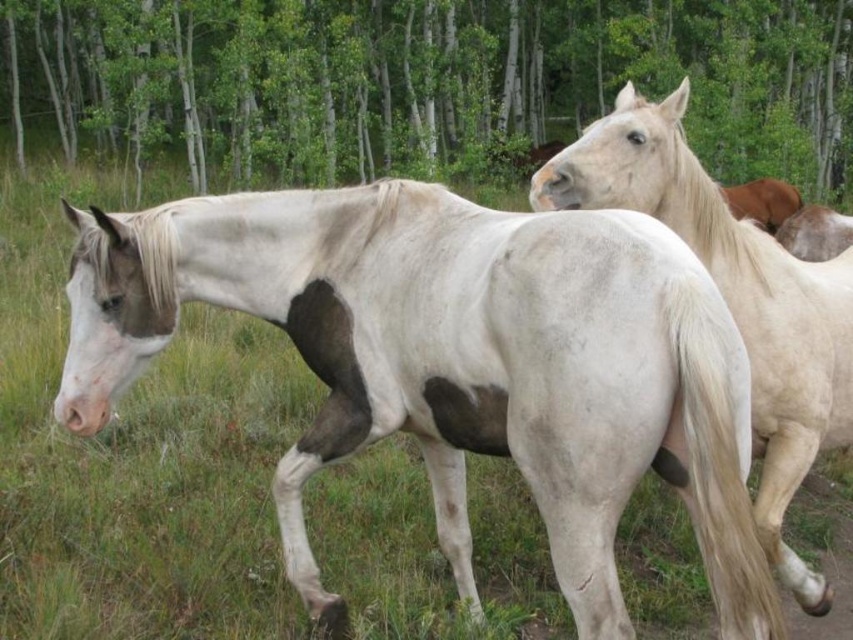
Question: Among these objects, which one is nearest to the camera?

Choices:
 (A) white matte horse at center
 (B) green leafy tree at center

Answer: (A)

Question: Does green leafy tree at center appear on the left side of white matte horse at upper right?

Choices:
 (A) no
 (B) yes

Answer: (B)

Question: From the image, what is the correct spatial relationship of white matte horse at center in relation to brown glossy horse at upper right?

Choices:
 (A) below
 (B) above

Answer: (A)

Question: Considering the real-world distances, which object is farthest from the green leafy tree at center?

Choices:
 (A) white matte horse at upper right
 (B) white matte horse at center
 (C) brown glossy horse at upper right

Answer: (A)

Question: Is green leafy tree at center bigger than white matte horse at upper right?

Choices:
 (A) yes
 (B) no

Answer: (A)

Question: Among these objects, which one is farthest from the camera?

Choices:
 (A) green leafy tree at center
 (B) white matte horse at upper right
 (C) white matte horse at center
 (D) brown glossy horse at upper right

Answer: (A)